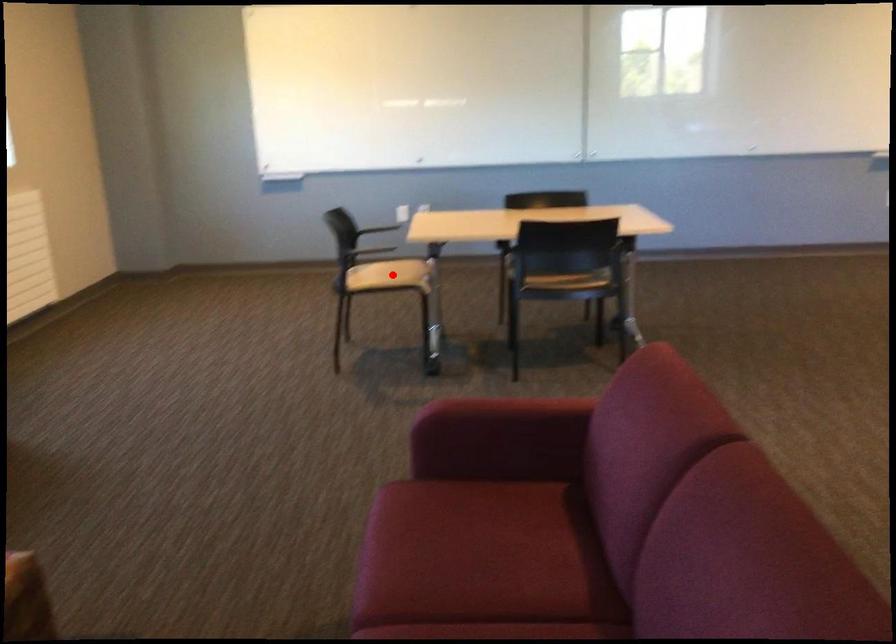
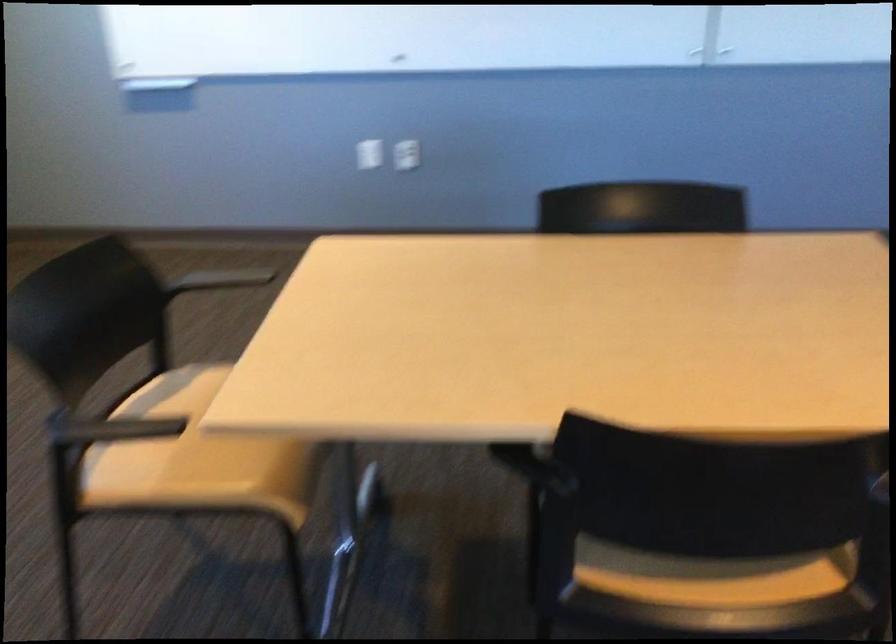
Question: I am providing you with two images of the same scene from different viewpoints. A red point is shown in image1. For the corresponding object point in image2, is it positioned nearer or farther from the camera?

Choices:
 (A) Nearer
 (B) Farther

Answer: (A)